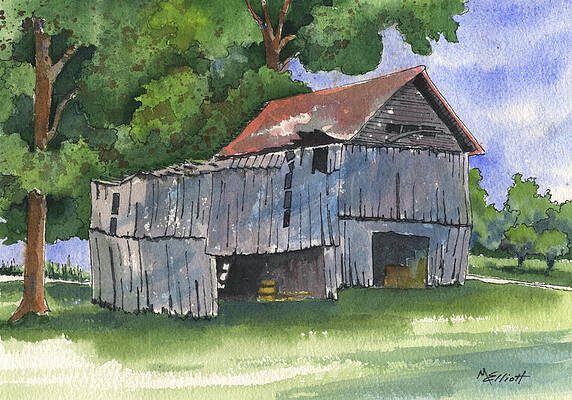
Where is `doorways`? The image size is (572, 400). doorways is located at coordinates (398, 247), (289, 266).